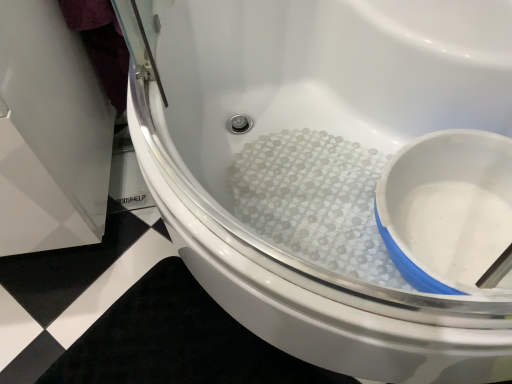
Question: Should I look upward or downward to see white matte powder at bottom right?

Choices:
 (A) up
 (B) down

Answer: (B)